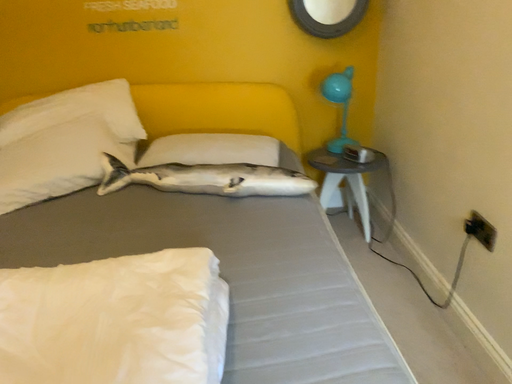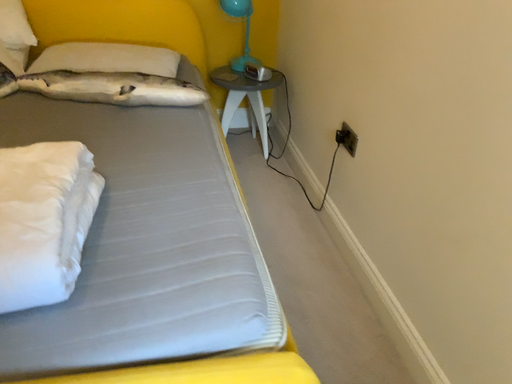
Question: Which way did the camera rotate in the video?

Choices:
 (A) rotated right
 (B) rotated left

Answer: (A)